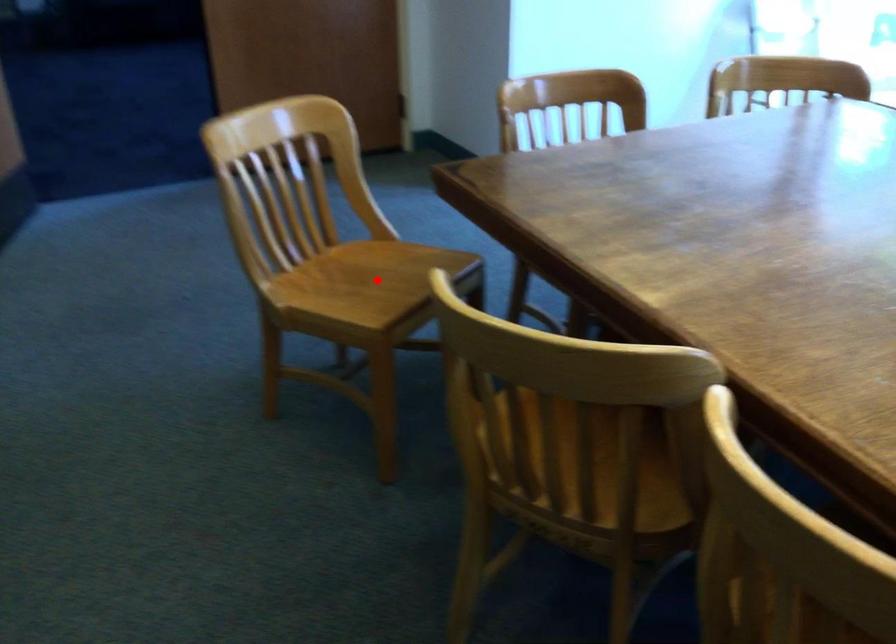
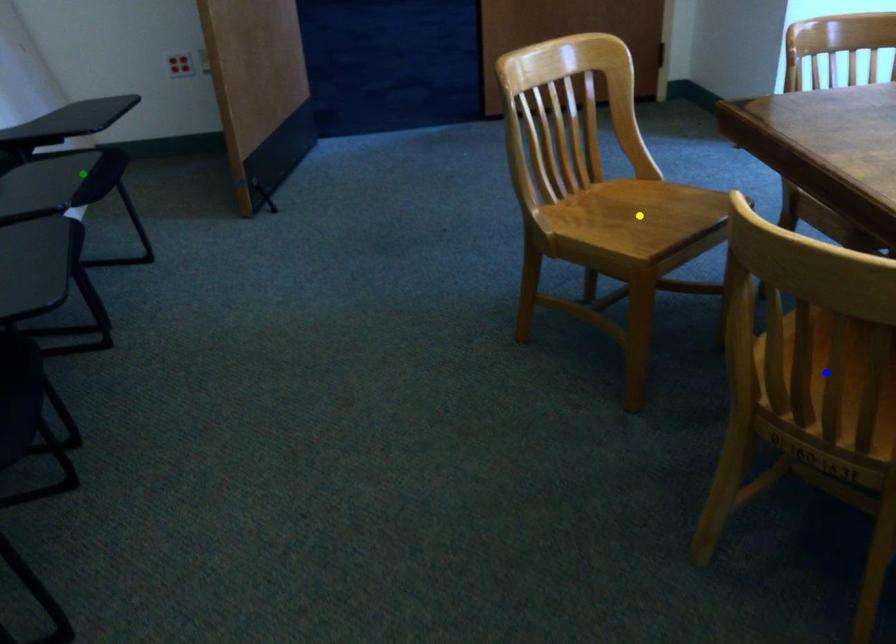
Question: I am providing you with two images of the same scene from different viewpoints. A red point is marked on the first image. You are given multiple points on the second image. Which point in image 2 represents the same 3d spot as the red point in image 1?

Choices:
 (A) blue point
 (B) green point
 (C) yellow point

Answer: (C)